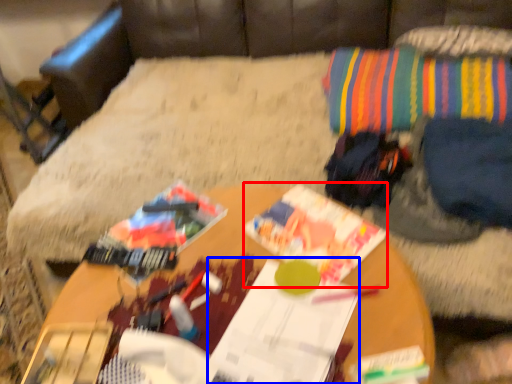
Question: Which point is closer to the camera, magazine (highlighted by a red box) or magazine (highlighted by a blue box)?

Choices:
 (A) magazine
 (B) magazine

Answer: (B)